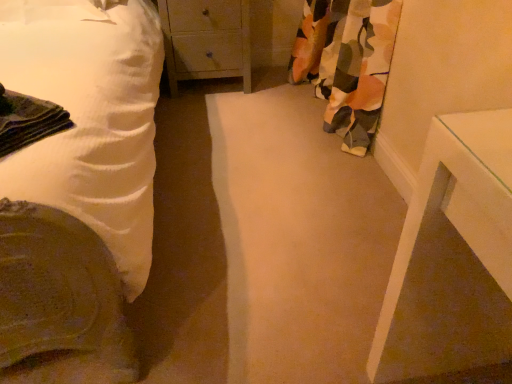
Question: Is wooden chest of drawers at center in front of or behind floral fabric curtain at right in the image?

Choices:
 (A) behind
 (B) front

Answer: (A)

Question: From a real-world perspective, is wooden chest of drawers at center physically located above or below floral fabric curtain at right?

Choices:
 (A) above
 (B) below

Answer: (B)

Question: Considering the real-world distances, which object is farthest from the wooden chest of drawers at center?

Choices:
 (A) floral fabric curtain at right
 (B) white cotton bed at left

Answer: (B)

Question: Which is nearer to the white cotton bed at left?

Choices:
 (A) floral fabric curtain at right
 (B) wooden chest of drawers at center

Answer: (B)